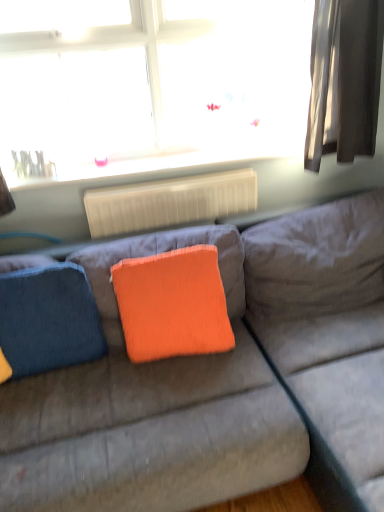
Question: In terms of size, does white glossy radiator at upper center appear bigger or smaller than transparent glass window at upper center?

Choices:
 (A) small
 (B) big

Answer: (A)

Question: Considering the positions of point (77, 175) and point (148, 41), is point (77, 175) closer or farther from the camera than point (148, 41)?

Choices:
 (A) closer
 (B) farther

Answer: (B)

Question: Which object is the closest to the white glossy radiator at upper center?

Choices:
 (A) orange fabric pillow at center
 (B) transparent glass window at upper center
 (C) silky gray curtain at right
 (D) white plastic radiator at center
 (E) velvet orange pillow at center

Answer: (D)

Question: Which is farther from the transparent glass window at upper center?

Choices:
 (A) white plastic radiator at center
 (B) white glossy radiator at upper center
 (C) denim cushion at left
 (D) velvet orange pillow at center
 (E) orange fabric pillow at center

Answer: (C)